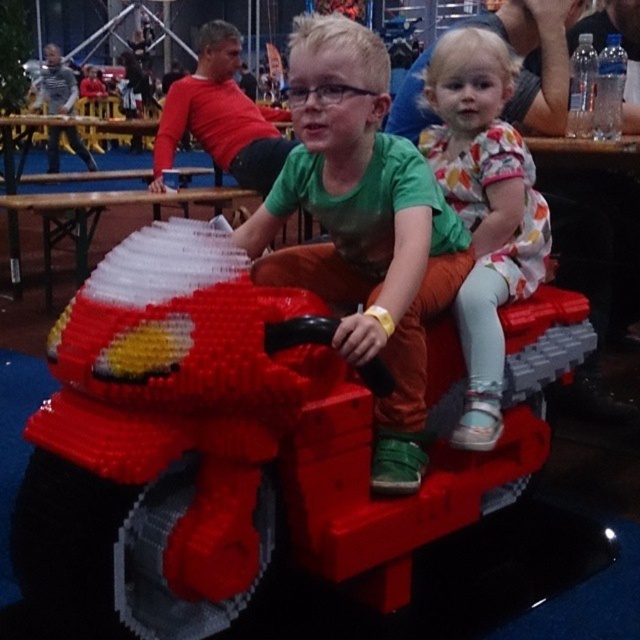
You are a photographer trying to capture a photo of the red plastic motorcycle at center and the floral dress at center. Since both are at the center, how can you position yourself to ensure both are fully visible in the frame?

The red plastic motorcycle at center is in front of the floral dress at center. To ensure both are fully visible, position yourself so you can see around or behind the motorcycle to include the dress in the background.

You are a photographer trying to capture the boy at the center of the image. The camera you are using has a focus point at coordinate point [362,227]. Will the focus point successfully capture the boy?

Yes, the focus point at coordinate point [362,227] marks the location of the matte plastic boy at center, so the focus point will successfully capture the boy.